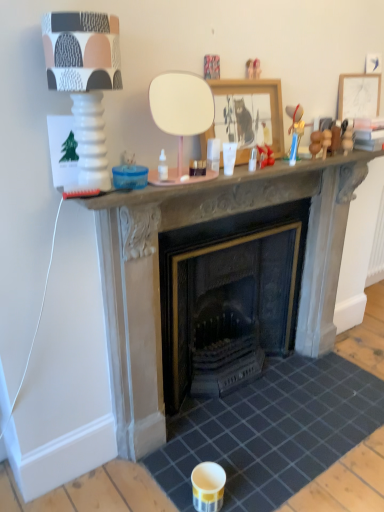
Where is `empty space that is ontop of wooden framed picture at center, which appears as the first picture frame when viewed from the left (from a real-world perspective)`? The height and width of the screenshot is (512, 384). empty space that is ontop of wooden framed picture at center, which appears as the first picture frame when viewed from the left (from a real-world perspective) is located at coordinates (250, 73).